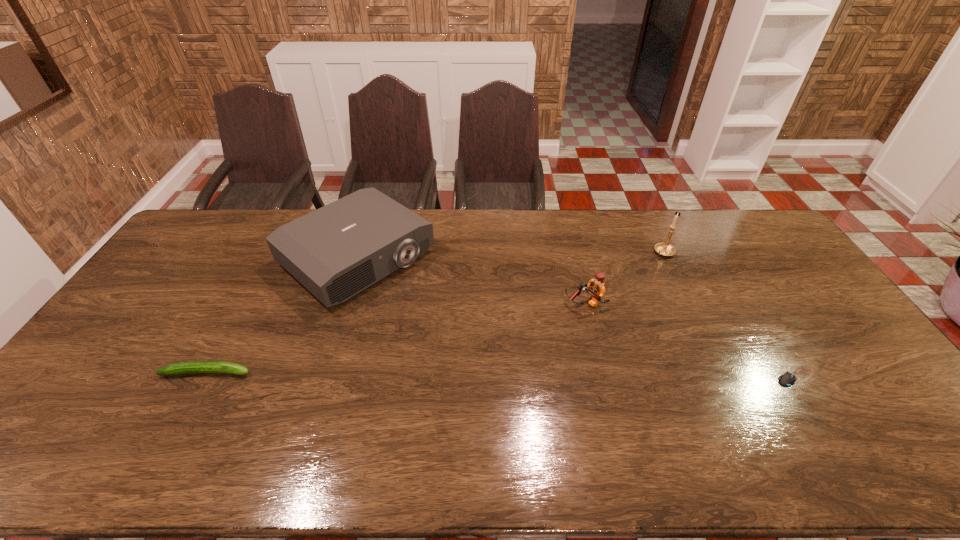
Image resolution: width=960 pixels, height=540 pixels. Find the location of `the second shortest object`. the second shortest object is located at coordinates (193, 367).

Where is `mouse`? mouse is located at coordinates (787, 379).

Locate an element on the screen. The image size is (960, 540). the rightmost object is located at coordinates (787, 379).

At what (x,y) coordinates should I click in order to perform the action: click on the second object from right to left. Please return your answer as a coordinate pair (x, y). Looking at the image, I should click on (665, 249).

Identify the location of candle holder. (665, 249).

Image resolution: width=960 pixels, height=540 pixels. What are the coordinates of `projector` in the screenshot? It's located at (335, 252).

At what (x,y) coordinates should I click in order to perform the action: click on the third object from right to left. Please return your answer as a coordinate pair (x, y). Looking at the image, I should click on (596, 290).

Locate an element on the screen. vacant space located 0.090m on the front-facing side of the zucchini is located at coordinates (286, 372).

Locate an element on the screen. This screenshot has height=540, width=960. free space located on the left of the rightmost object is located at coordinates 696,377.

Identify the location of blank space located 0.210m on the handle side of the fourth object from left to right. point(628,289).